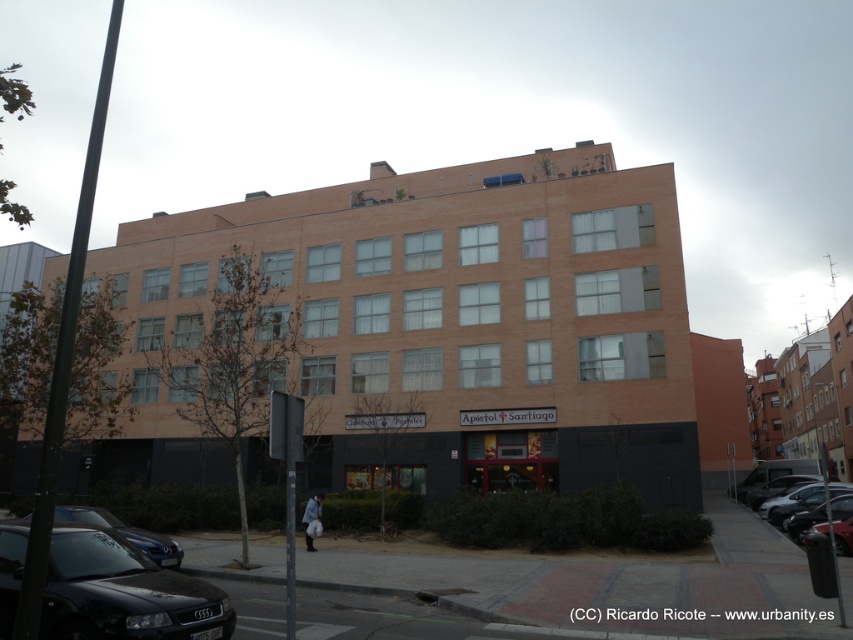
Is brick building at center positioned at the back of metallic silver car at lower right?

Yes, it is behind metallic silver car at lower right.

Based on the photo, is brick building at center closer to the viewer compared to metallic silver car at lower right?

No, brick building at center is further to the viewer.

Is point (483, 182) positioned in front of point (840, 525)?

No, (483, 182) is further to viewer.

At what (x,y) coordinates should I click in order to perform the action: click on brick building at center. Please return your answer as a coordinate pair (x, y). This screenshot has height=640, width=853. Looking at the image, I should click on (427, 330).

Is brick building at center wider than shiny black car at right?

Yes, brick building at center is wider than shiny black car at right.

Is point (540, 422) positioned before point (744, 481)?

Yes, point (540, 422) is closer to viewer.

I want to click on brick building at center, so click(x=427, y=330).

Does brick building at right appear under metallic silver car at lower right?

Correct, brick building at right is located below metallic silver car at lower right.

Can you confirm if brick building at right is positioned to the left of metallic silver car at lower right?

Incorrect, brick building at right is not on the left side of metallic silver car at lower right.

Describe the element at coordinates (817, 394) in the screenshot. I see `brick building at right` at that location.

The width and height of the screenshot is (853, 640). What are the coordinates of `brick building at right` in the screenshot? It's located at (817, 394).